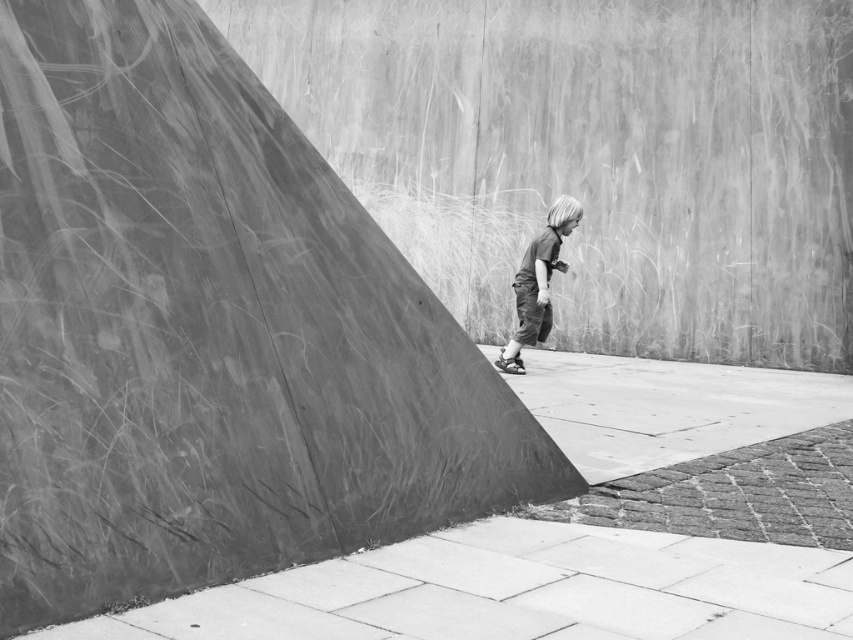
You are a delivery robot with a 1.2 meter wide package. You need to move from the smooth concrete pavement at lower center to the dark gray fabric pants at center. Is there enough space between them for your package?

The smooth concrete pavement at lower center might be wider than dark gray fabric pants at center, so there may be sufficient space for the 1.2 meter wide package. However, since the exact width difference isn not specified, proceed with caution.

Consider the image. You are a delivery person with a 36 inch wide cart. You need to move from the smooth concrete ramp at center to the smooth concrete pavement at lower center. Can your cart fit through the space between them?

The smooth concrete ramp at center and smooth concrete pavement at lower center are 33.43 inches apart. Since your cart is 36 inches wide, it cannot fit through the space between them.